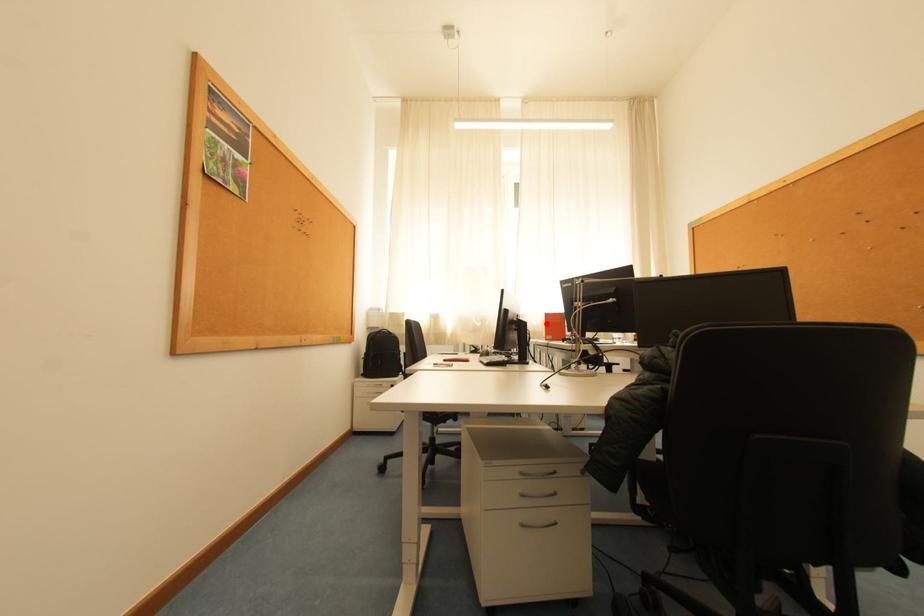
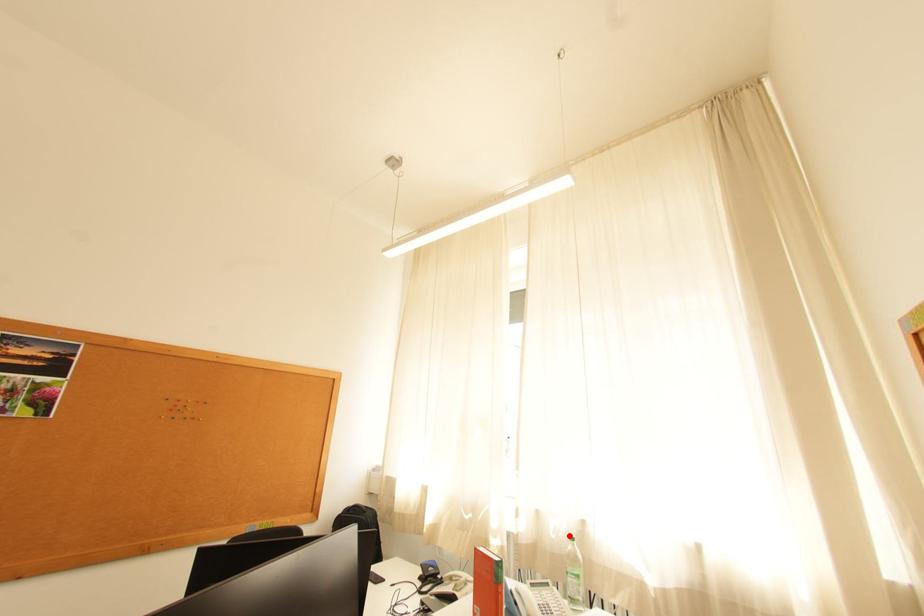
I am providing you with two images of the same scene from different viewpoints. A red point is marked on the first image and another point is marked on the second image. Are the points marked in image1 and image2 representing the same 3D position?

Yes